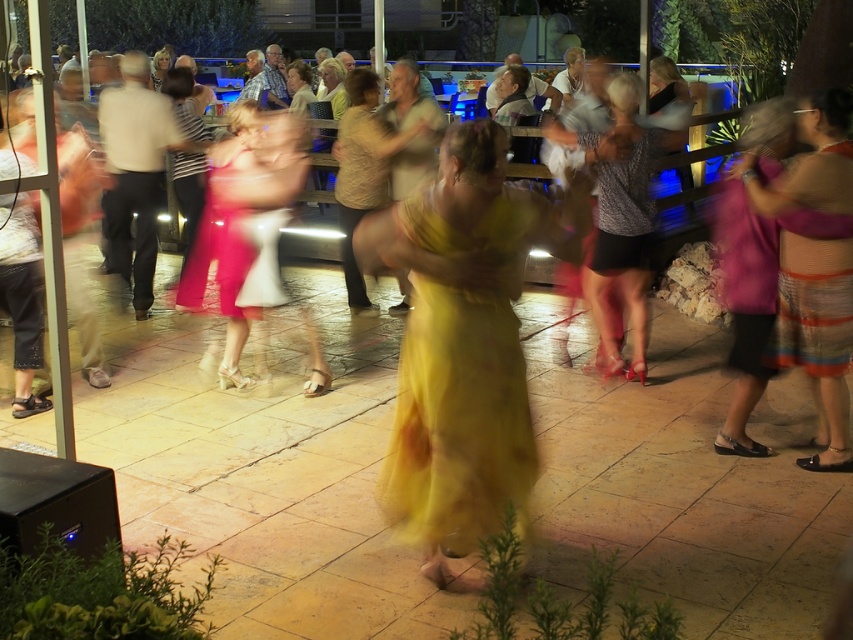
You are a photographer at the event and want to capture a photo that includes both the yellow satin dress at center and the striped dress at right. Which dress should you focus on to ensure both are in the frame?

To include both the yellow satin dress at center and the striped dress at right in the photo, focus on the yellow satin dress at center since it is in front of the striped dress at right, ensuring both are visible in the frame.